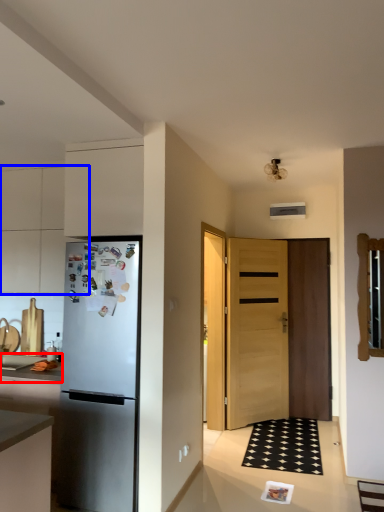
Question: Which object is further to the camera taking this photo, countertop (highlighted by a red box) or cabinetry (highlighted by a blue box)?

Choices:
 (A) countertop
 (B) cabinetry

Answer: (B)